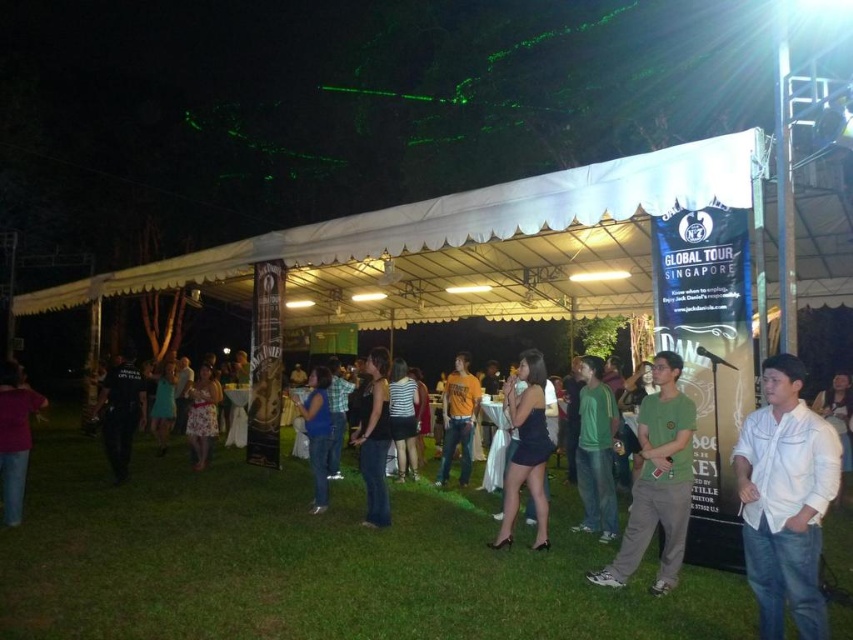
You are standing inside the tent at the nighttime event and want to move from point A to point B. Point A is at coordinate point (444, 403) and point B is at coordinate point (312, 433). Which point is closer to you when you start moving?

Point A at coordinate point (444, 403) is closer to you because it is further to the viewer than point B at coordinate point (312, 433), meaning you can reach it sooner.